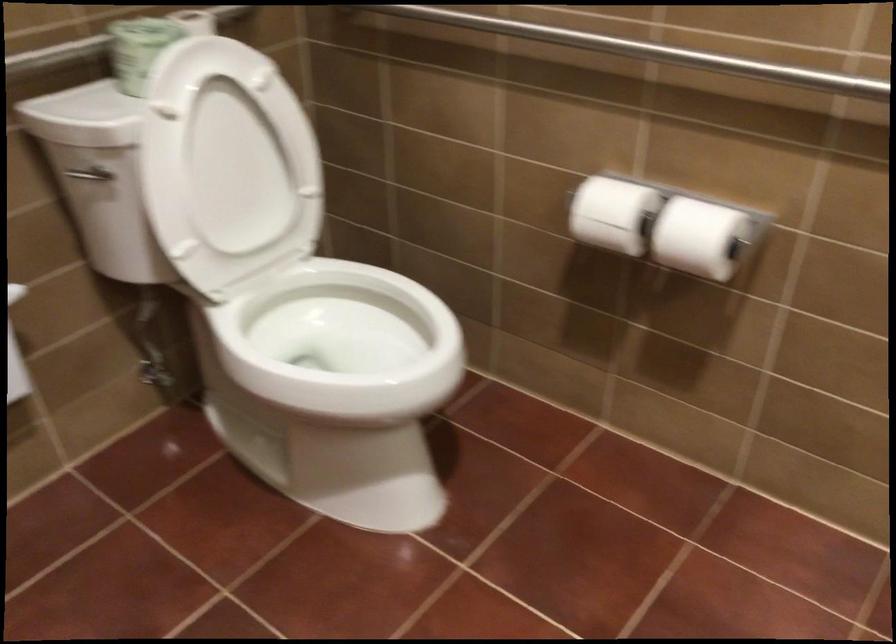
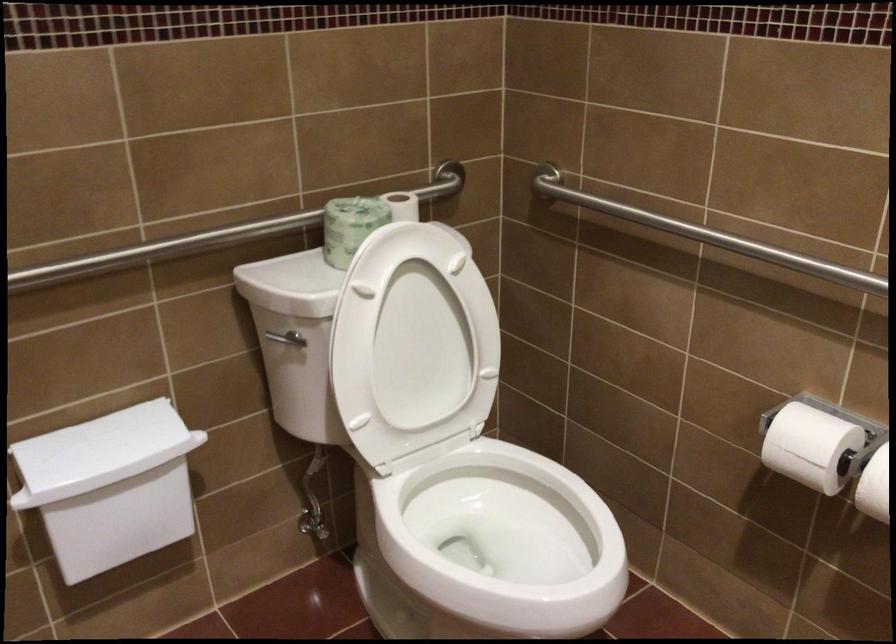
Question: I am providing you with two images of the same scene from different viewpoints. Please identify which objects are invisible in image2.

Choices:
 (A) white toilet seat
 (B) white dispenser lid
 (C) green toilet paper roll
 (D) none of these

Answer: (D)